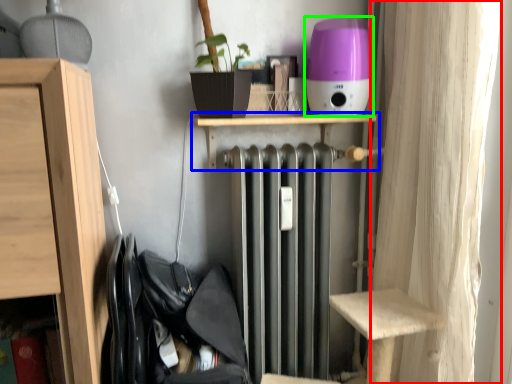
Question: Considering the real-world distances, which object is closest to curtain (highlighted by a red box)? shelf (highlighted by a blue box) or appliance (highlighted by a green box).

Choices:
 (A) shelf
 (B) appliance

Answer: (B)